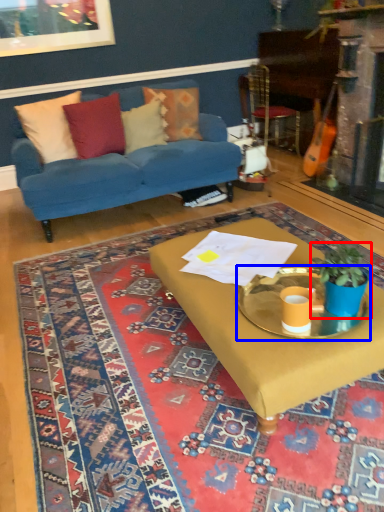
Question: Which of the following is the farthest to the observer, houseplant (highlighted by a red box) or round table (highlighted by a blue box)?

Choices:
 (A) houseplant
 (B) round table

Answer: (B)